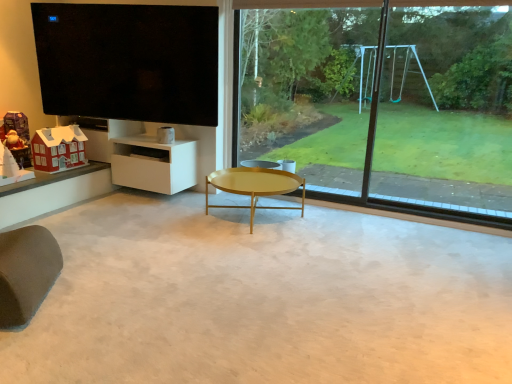
Locate an element on the screen. vacant space underneath gold metallic coffee table at center (from a real-world perspective) is located at coordinates (254, 220).